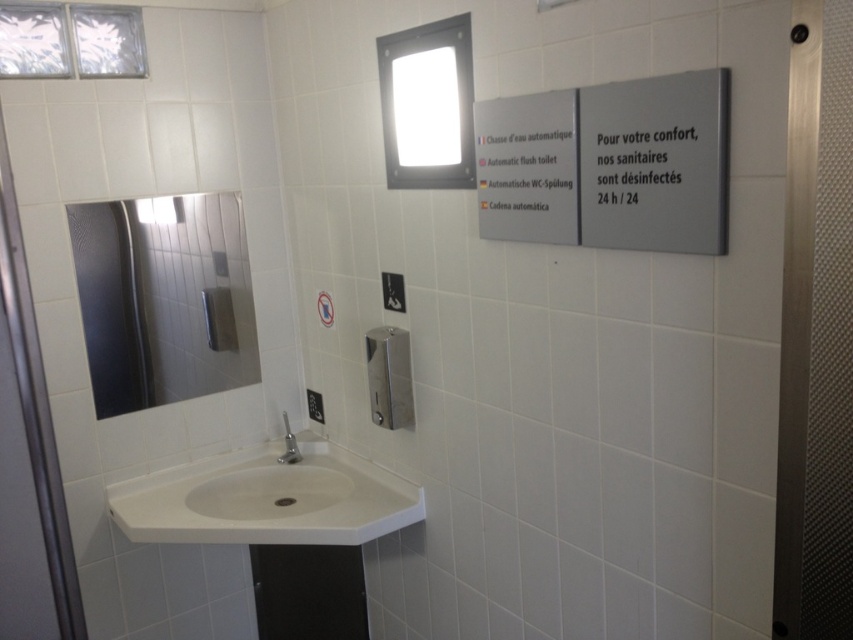
Question: Can you confirm if metallic silver sign at upper center is wider than satin nickel faucet at corner?

Choices:
 (A) no
 (B) yes

Answer: (B)

Question: Which point is farther from the camera taking this photo?

Choices:
 (A) tap(277, 461)
 (B) tap(181, 362)

Answer: (A)

Question: Does gray matte sign at upper right appear on the right side of metallic silver sign at upper center?

Choices:
 (A) no
 (B) yes

Answer: (B)

Question: Which point is closer to the camera taking this photo?

Choices:
 (A) (552, 225)
 (B) (250, 358)
 (C) (283, 424)
 (D) (171, 536)

Answer: (A)

Question: Which of the following is the farthest from the observer?

Choices:
 (A) (387, 524)
 (B) (233, 257)
 (C) (723, 180)

Answer: (B)

Question: Does white glossy sink at lower center have a greater width compared to satin nickel faucet at corner?

Choices:
 (A) no
 (B) yes

Answer: (B)